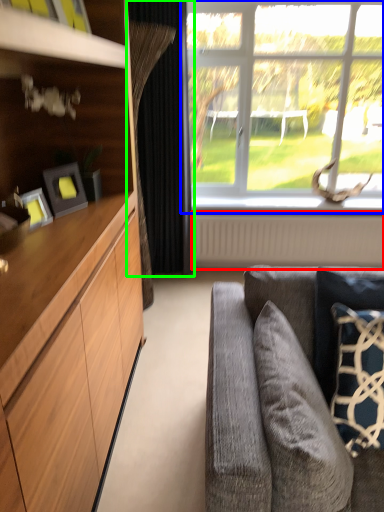
Question: Which object is positioned farthest from radiator (highlighted by a red box)? Select from window (highlighted by a blue box) and curtain (highlighted by a green box).

Choices:
 (A) window
 (B) curtain

Answer: (B)